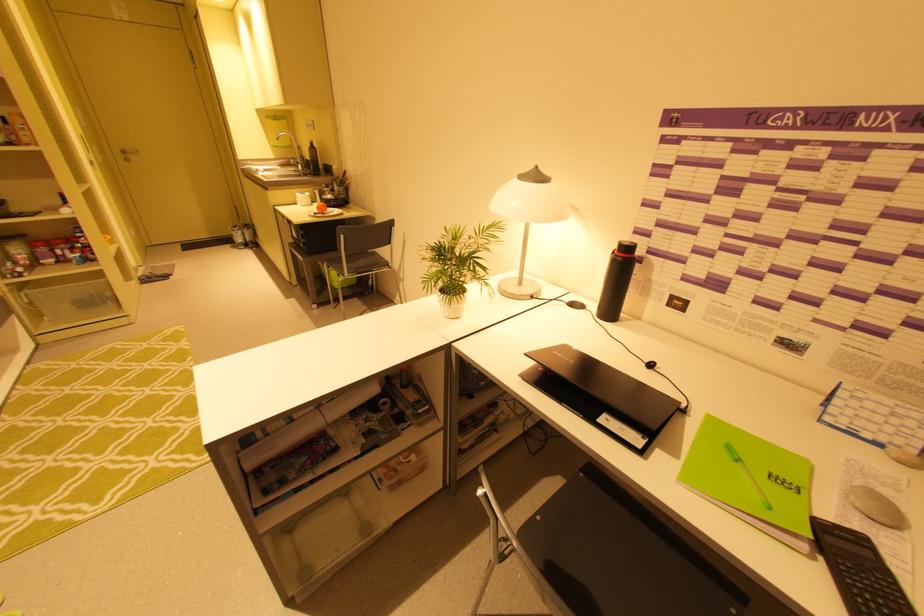
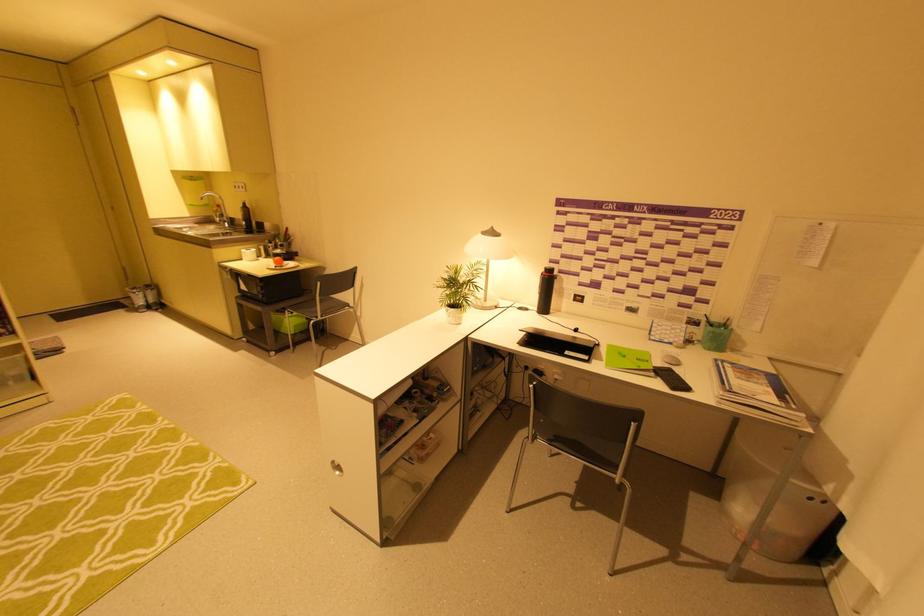
The point at (325, 212) is marked in the first image. Where is the corresponding point in the second image?

(283, 265)